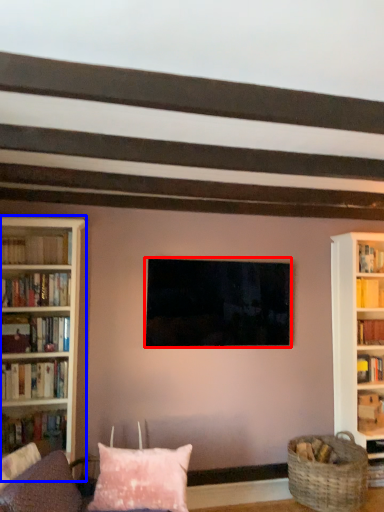
Question: Which point is closer to the camera, television (highlighted by a red box) or bookcase (highlighted by a blue box)?

Choices:
 (A) television
 (B) bookcase

Answer: (B)